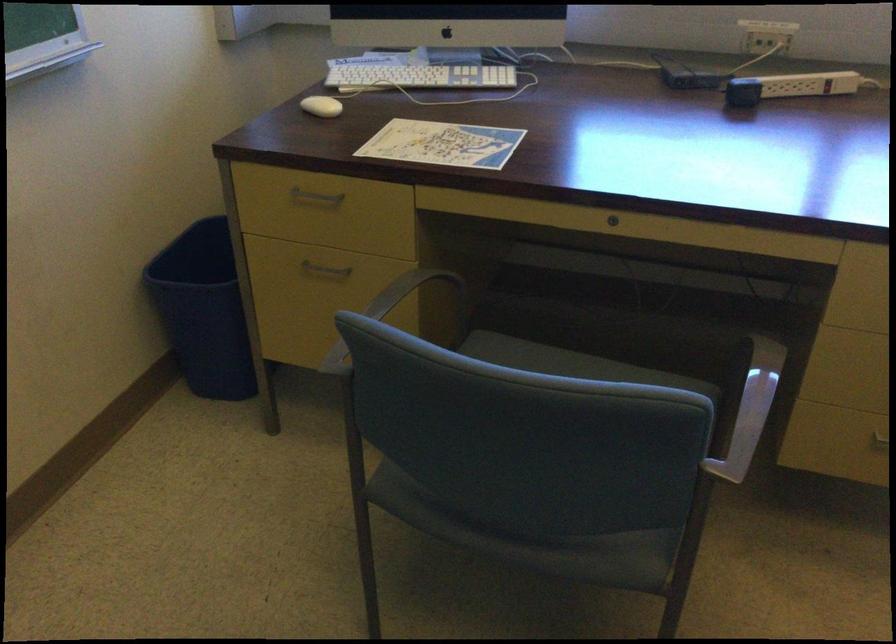
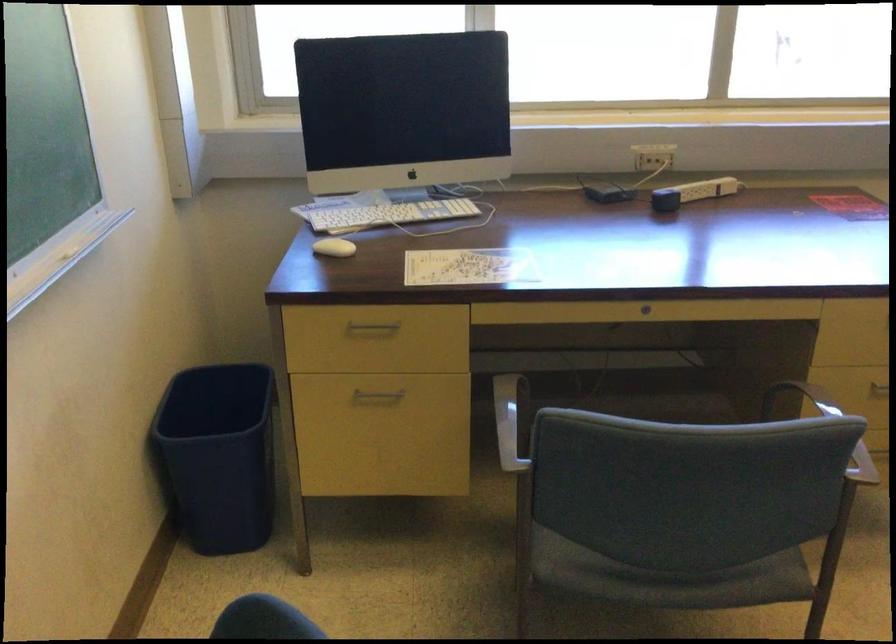
In the second image, find the point that corresponds to point (737, 93) in the first image.

(665, 200)